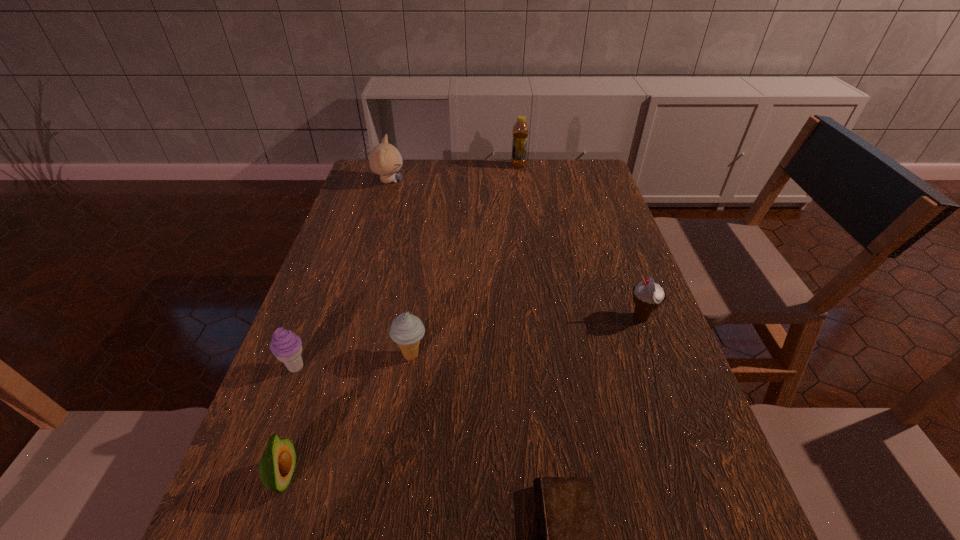
Where is `vacant space situated 0.150m on the back of the rightmost icecream`? The height and width of the screenshot is (540, 960). vacant space situated 0.150m on the back of the rightmost icecream is located at coordinates (622, 267).

Where is `free space located on the back of the fourth object from left to right`? This screenshot has width=960, height=540. free space located on the back of the fourth object from left to right is located at coordinates (421, 282).

Where is `free location located on the back of the leftmost icecream`? free location located on the back of the leftmost icecream is located at coordinates (340, 251).

You are a GUI agent. You are given a task and a screenshot of the screen. Output one action in this format:
    pyautogui.click(x=<x>, y=<y>)
    Task: Click on the free space located on the cut side of the avocado
    The height and width of the screenshot is (540, 960).
    Given the screenshot: What is the action you would take?
    pyautogui.click(x=419, y=477)

This screenshot has width=960, height=540. I want to click on bottle that is at the far edge, so click(x=520, y=132).

Locate an element on the screen. Image resolution: width=960 pixels, height=540 pixels. kitten that is at the far edge is located at coordinates [385, 160].

The height and width of the screenshot is (540, 960). Find the location of `kitten located at the left edge`. kitten located at the left edge is located at coordinates (385, 160).

The image size is (960, 540). In order to click on icecream present at the left edge in this screenshot , I will do `click(287, 347)`.

The height and width of the screenshot is (540, 960). Identify the location of avocado that is at the left edge. (277, 464).

Where is `object present at the right edge`? This screenshot has height=540, width=960. object present at the right edge is located at coordinates (648, 296).